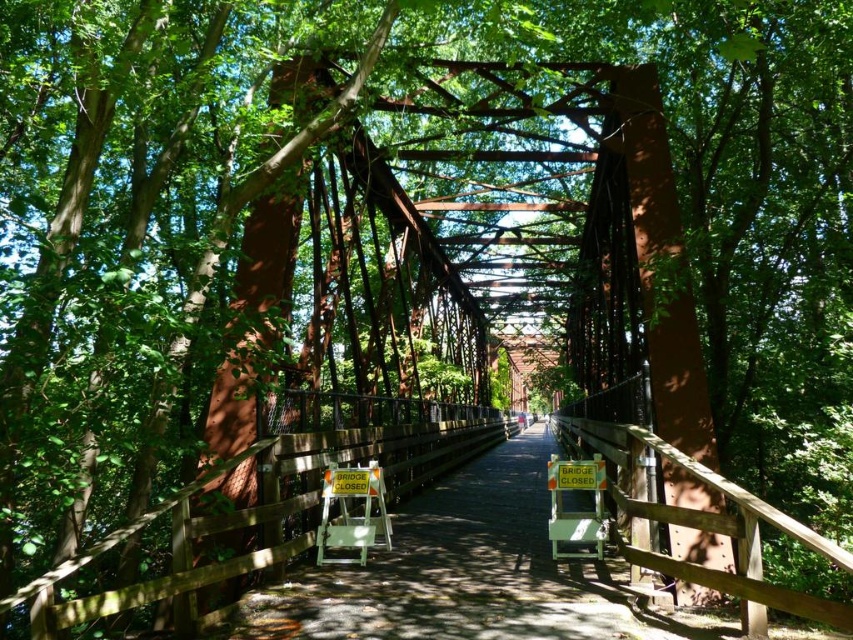
Question: Can you confirm if orange plastic chair at center is bigger than orange plastic sign at center?

Choices:
 (A) no
 (B) yes

Answer: (A)

Question: Is orange plastic chair at center in front of orange plastic sign at center?

Choices:
 (A) yes
 (B) no

Answer: (A)

Question: Observing the image, what is the correct spatial positioning of orange plastic chair at center in reference to orange plastic sign at center?

Choices:
 (A) right
 (B) left

Answer: (B)

Question: Which point appears closest to the camera in this image?

Choices:
 (A) (573, 461)
 (B) (325, 470)

Answer: (B)

Question: Which point is farther from the camera taking this photo?

Choices:
 (A) (366, 499)
 (B) (567, 540)

Answer: (B)